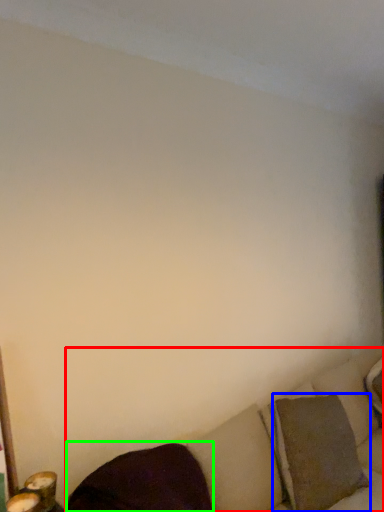
Question: Estimate the real-world distances between objects in this image. Which object is closer to studio couch (highlighted by a red box), pillow (highlighted by a blue box) or pillow (highlighted by a green box)?

Choices:
 (A) pillow
 (B) pillow

Answer: (A)